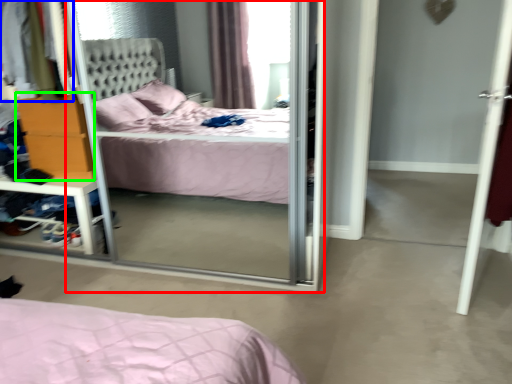
Question: Which is nearer to the screen door (highlighted by a red box)? clothing (highlighted by a blue box) or dresser (highlighted by a green box).

Choices:
 (A) clothing
 (B) dresser

Answer: (B)